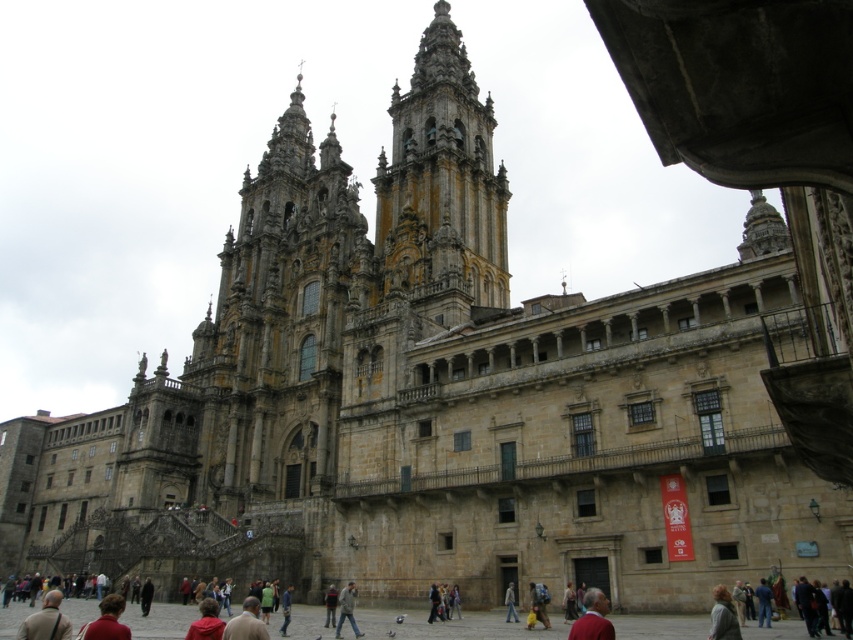
You are an architect visiting the cathedral and notice the golden stone tower at center and the gray fabric jacket at center. Which object is wider?

The golden stone tower at center is wider than the gray fabric jacket at center.